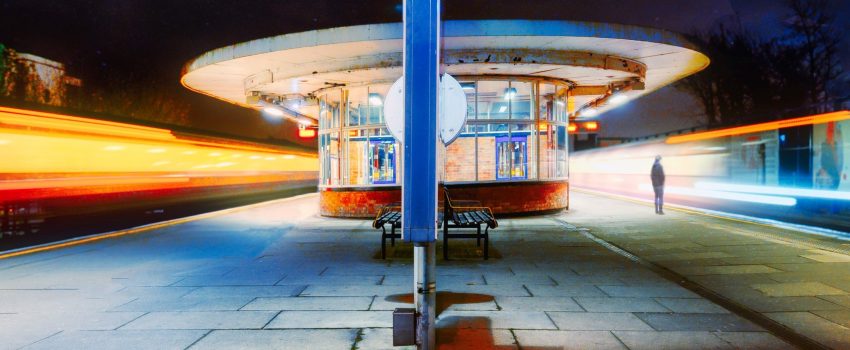
Identify the location of upper windows. The width and height of the screenshot is (850, 350). (326, 117), (354, 114), (376, 114), (473, 109), (499, 105), (528, 104), (553, 103).